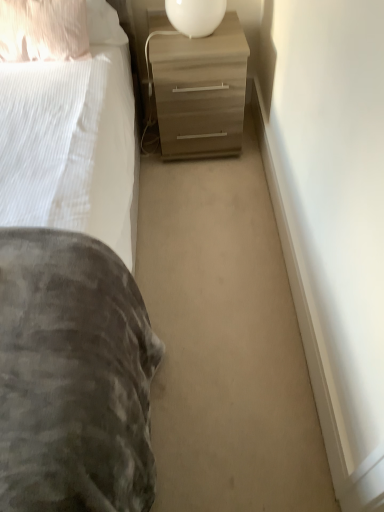
Where is `free space in front of white glossy table lamp at upper center`? The width and height of the screenshot is (384, 512). free space in front of white glossy table lamp at upper center is located at coordinates 195,50.